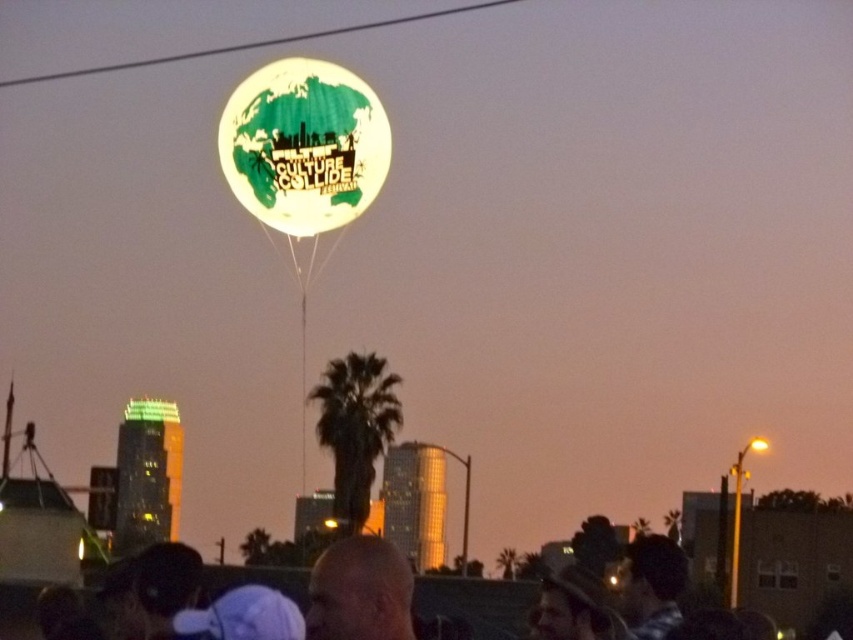
This screenshot has width=853, height=640. I want to click on bald head at upper center, so click(x=360, y=592).

Which is more to the left, bald head at upper center or green matte balloon at upper center?

Positioned to the left is green matte balloon at upper center.

Locate an element on the screen. This screenshot has width=853, height=640. bald head at upper center is located at coordinates (360, 592).

Between translucent white balloon at center and bald head at upper center, which one is positioned lower?

Positioned lower is bald head at upper center.

Which is above, translucent white balloon at center or bald head at upper center?

translucent white balloon at center is above.

Between point (242, 170) and point (408, 632), which one is positioned in front?

Point (242, 170) is more forward.

Identify the location of translucent white balloon at center. (305, 145).

Is translucent white balloon at center wider than green matte balloon at upper center?

Incorrect, translucent white balloon at center's width does not surpass green matte balloon at upper center's.

Between point (306, 202) and point (206, 52), which one is positioned behind?

The point (206, 52) is behind.

Does point (253, 164) come closer to viewer compared to point (305, 38)?

Yes, point (253, 164) is in front of point (305, 38).

Locate an element on the screen. translucent white balloon at center is located at coordinates (305, 145).